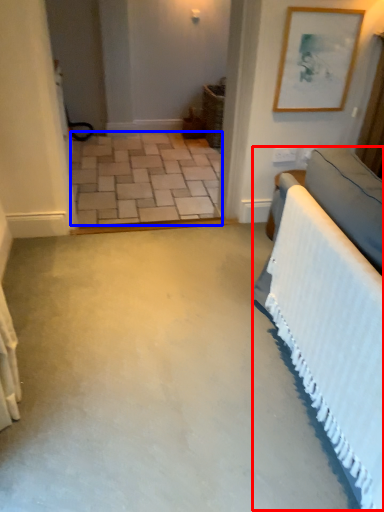
Question: Which point is closer to the camera, bed (highlighted by a red box) or concrete (highlighted by a blue box)?

Choices:
 (A) bed
 (B) concrete

Answer: (A)